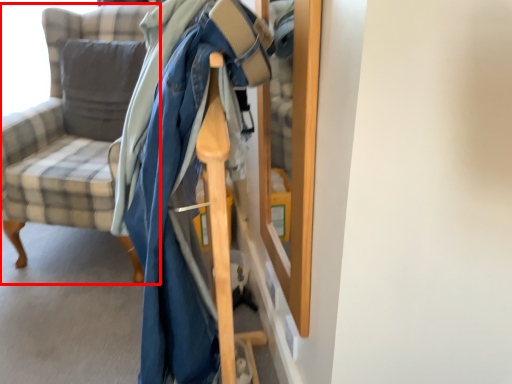
Question: From the image's perspective, what is the correct spatial positioning of chair (annotated by the red box) in reference to pillow?

Choices:
 (A) above
 (B) below

Answer: (B)